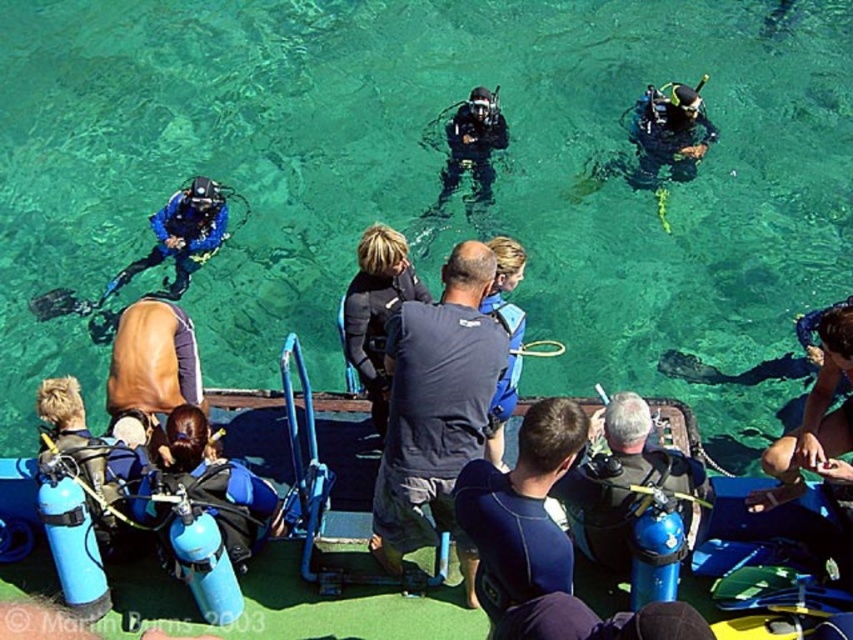
Question: Estimate the real-world distances between objects in this image. Which object is farther from the dark blue fabric at center?

Choices:
 (A) blue rubber boat at lower center
 (B) clear water at lower center

Answer: (B)

Question: Does blue matte scuba tank at center appear on the left side of blue rubber boat at lower center?

Choices:
 (A) yes
 (B) no

Answer: (B)

Question: Among these points, which one is farthest from the camera?

Choices:
 (A) (80, 525)
 (B) (608, 477)

Answer: (A)

Question: Is clear water at lower center smaller than blue matte scuba gear at lower left?

Choices:
 (A) yes
 (B) no

Answer: (B)

Question: Which point is farther from the camera taking this photo?

Choices:
 (A) (692, 516)
 (B) (3, 499)
 (C) (199, 484)
 (D) (447, 172)

Answer: (D)

Question: Can you confirm if blue matte scuba tank at center is positioned above black matte wetsuit at center?

Choices:
 (A) no
 (B) yes

Answer: (A)